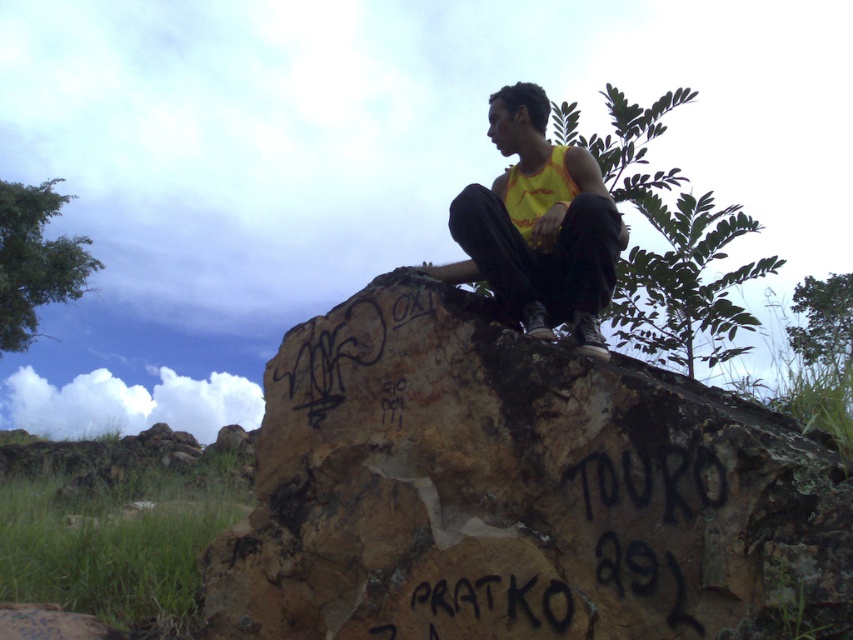
You are a photographer trying to capture the graffiti on the brown rough rock at upper center while also including the yellow fabric tank top at center in the shot. Since the rock is in front of the tank top, how should you adjust your camera position to ensure both are visible in the frame?

Since the brown rough rock at upper center is in front of the yellow fabric tank top at center, you should move your camera position backward to create more depth, allowing both the rock and the tank top to be visible in the frame.

You are standing at a point 3 meters away from the camera. You want to walk towards the rock where the person is sitting. Will you pass through the point labeled as point (x=260, y=548)?

The point (x=260, y=548) is 3.00 meters away from the camera. Since you are starting at a point 3 meters away, you are already at that point and won

You are standing at the point labeled point (502, 195) and want to walk to the point labeled point (773, 448). According to the scene description, which direction should you move to reach your destination?

You should move forward because point (773, 448) is in front of point (502, 195).